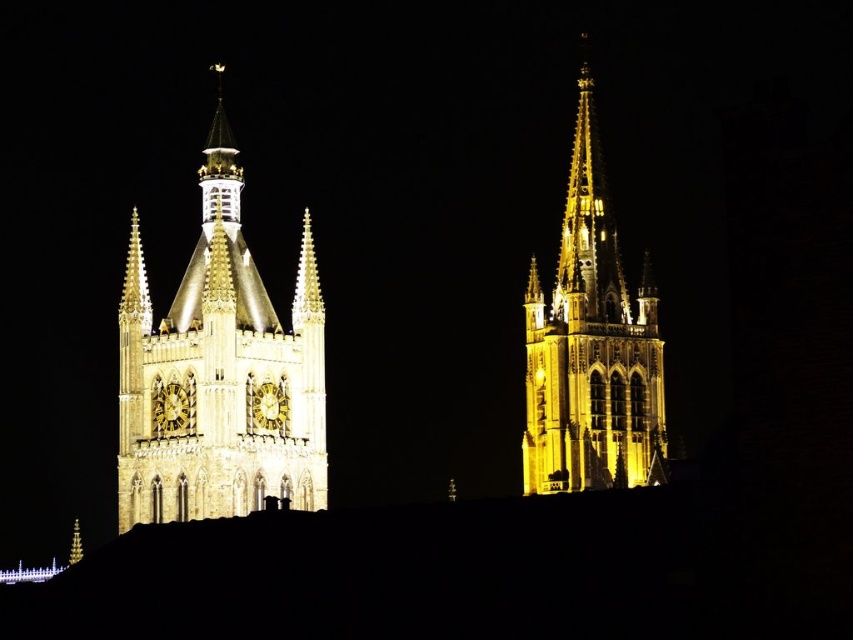
Question: Which of these objects is positioned farthest from the gold metallic spire at upper center?

Choices:
 (A) golden stone tower at left
 (B) gold metallic spire at center
 (C) golden stone tower at upper right

Answer: (C)

Question: Which point is closer to the camera?

Choices:
 (A) (77, 556)
 (B) (206, 189)
 (C) (554, 403)
 (D) (294, 324)

Answer: (D)

Question: Can you confirm if golden stone tower at left is positioned to the right of gold metallic spire at upper center?

Choices:
 (A) no
 (B) yes

Answer: (B)

Question: Which is nearer to the golden stone tower at upper right?

Choices:
 (A) gold polished spire at upper center
 (B) gold metallic spire at center
 (C) gold metallic spire at upper center
 (D) golden stone tower at left

Answer: (B)

Question: Can you confirm if golden stone tower at left is positioned to the right of golden stone tower at upper right?

Choices:
 (A) no
 (B) yes

Answer: (A)

Question: Is golden stone tower at left further to the viewer compared to gold metallic spire at center?

Choices:
 (A) no
 (B) yes

Answer: (A)